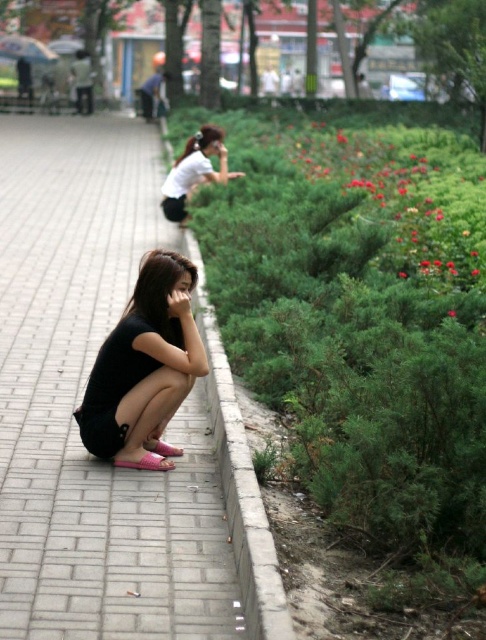
Question: Does white matte shirt at upper center lie behind red matte flower at upper right?

Choices:
 (A) yes
 (B) no

Answer: (A)

Question: Is black matte dress at lower left above red matte flower at upper right?

Choices:
 (A) no
 (B) yes

Answer: (A)

Question: Does black matte dress at lower left appear on the right side of red matte flower at upper right?

Choices:
 (A) yes
 (B) no

Answer: (B)

Question: Which of these objects is positioned farthest from the black matte dress at lower left?

Choices:
 (A) red matte flowers at upper right
 (B) red matte flower at upper right

Answer: (A)

Question: Which of the following is the closest to the observer?

Choices:
 (A) gray brick pavement at lower left
 (B) red matte flowers at upper right
 (C) gray concrete curb at lower center

Answer: (A)

Question: Based on their relative distances, which object is nearer to the gray concrete curb at lower center?

Choices:
 (A) black matte dress at lower left
 (B) gray brick pavement at lower left

Answer: (A)